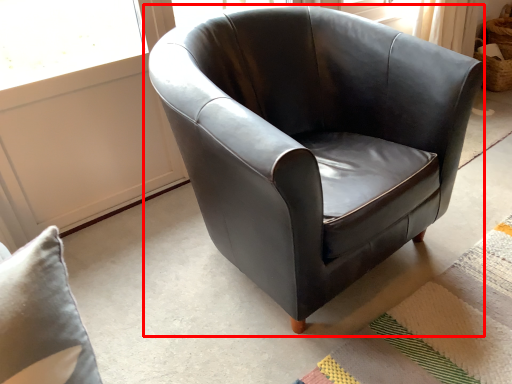
Question: From the image's perspective, where is chair (annotated by the red box) located relative to mat?

Choices:
 (A) above
 (B) below

Answer: (A)